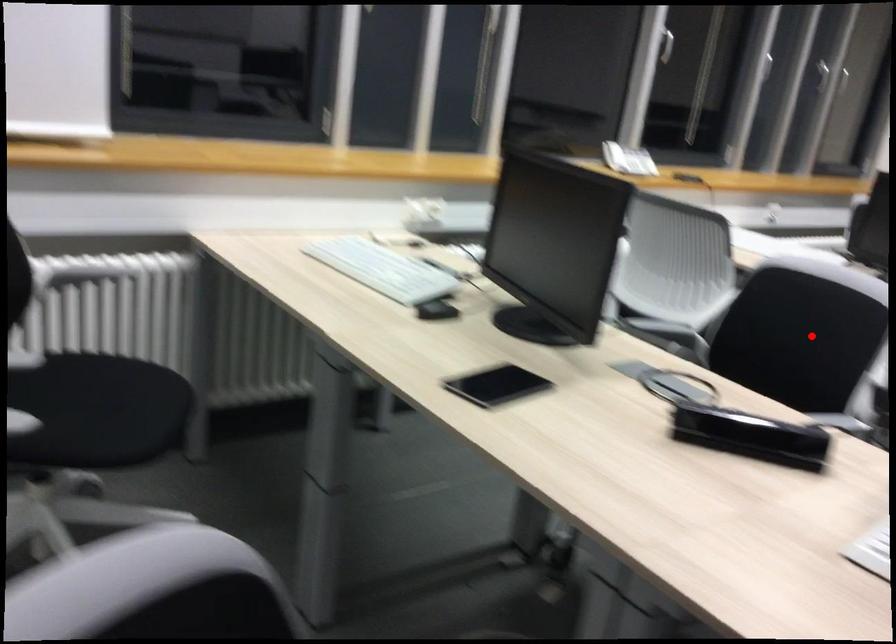
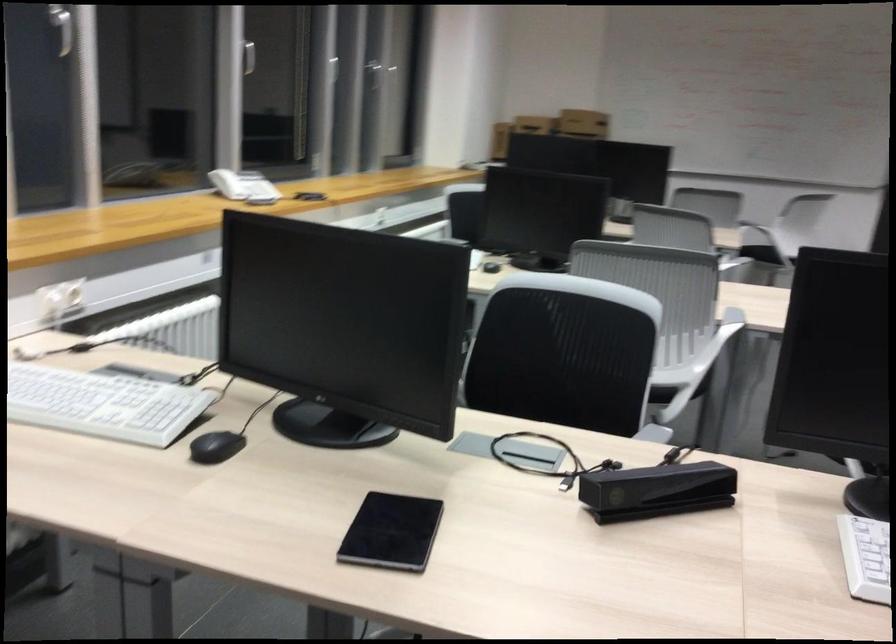
Find the pixel in the second image that matches the highlighted location in the first image.

(564, 353)